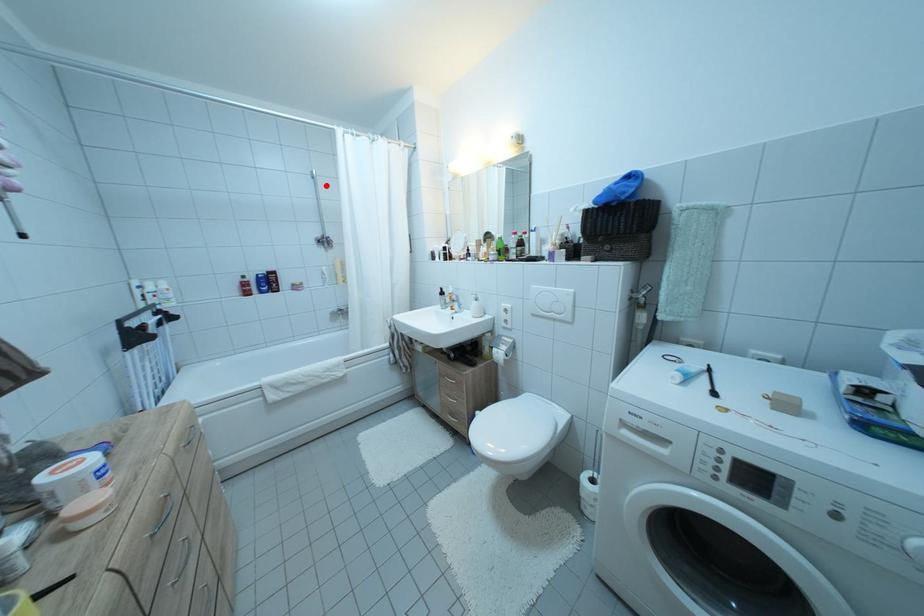
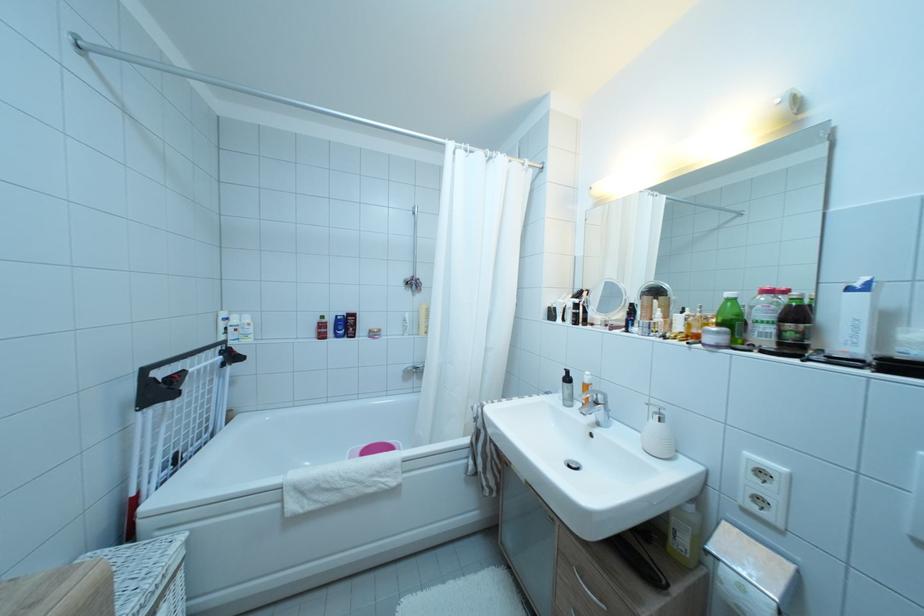
In the second image, find the point that corresponds to the highlighted location in the first image.

(428, 222)